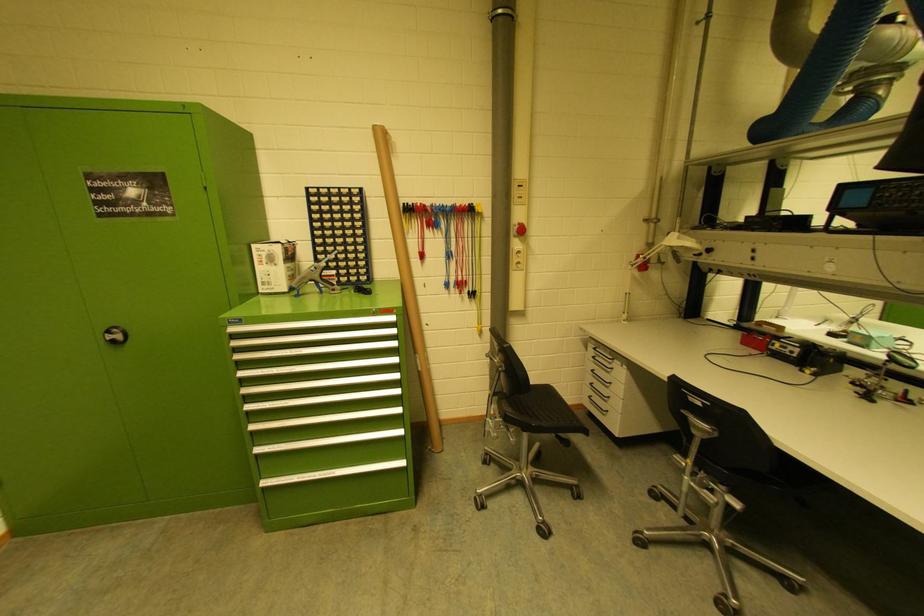
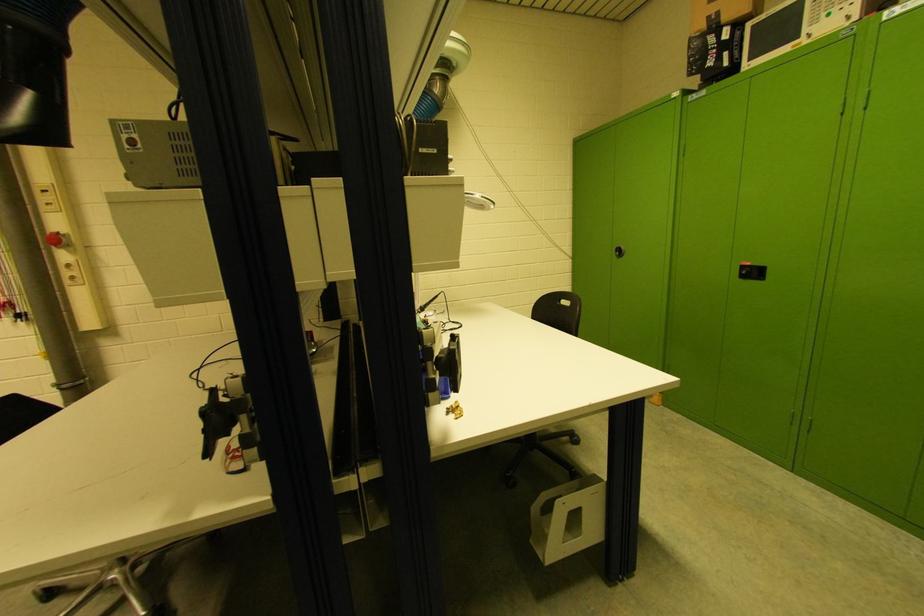
Question: The images are taken continuously from a first-person perspective. In which direction are you moving?

Choices:
 (A) Left
 (B) Right
 (C) Forward
 (D) Backward

Answer: (B)